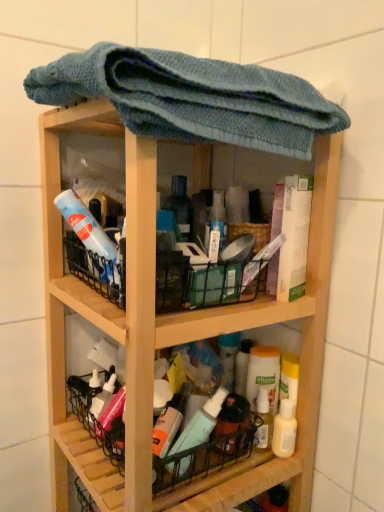
Question: Is blue knitted towel at upper center to the left of wooden shelf at center from the viewer's perspective?

Choices:
 (A) no
 (B) yes

Answer: (A)

Question: Is blue knitted towel at upper center positioned with its back to wooden shelf at center?

Choices:
 (A) no
 (B) yes

Answer: (B)

Question: From the image's perspective, is blue knitted towel at upper center below wooden shelf at center?

Choices:
 (A) no
 (B) yes

Answer: (A)

Question: Does blue knitted towel at upper center have a larger size compared to wooden shelf at center?

Choices:
 (A) yes
 (B) no

Answer: (B)

Question: Is blue knitted towel at upper center with wooden shelf at center?

Choices:
 (A) no
 (B) yes

Answer: (A)

Question: From a real-world perspective, is blue knitted towel at upper center physically below wooden shelf at center?

Choices:
 (A) no
 (B) yes

Answer: (A)

Question: Does translucent plastic mouthwash at lower right have a greater width compared to wooden shelf at center?

Choices:
 (A) yes
 (B) no

Answer: (B)

Question: Would you say translucent plastic mouthwash at lower right is outside wooden shelf at center?

Choices:
 (A) yes
 (B) no

Answer: (B)

Question: Is translucent plastic mouthwash at lower right shorter than wooden shelf at center?

Choices:
 (A) no
 (B) yes

Answer: (B)

Question: Is translucent plastic mouthwash at lower right not near wooden shelf at center?

Choices:
 (A) yes
 (B) no

Answer: (B)

Question: Is translucent plastic mouthwash at lower right closer to the viewer compared to wooden shelf at center?

Choices:
 (A) no
 (B) yes

Answer: (A)

Question: Can you confirm if translucent plastic mouthwash at lower right is positioned to the left of wooden shelf at center?

Choices:
 (A) yes
 (B) no

Answer: (B)

Question: Can we say wooden shelf at center lies outside translucent plastic mouthwash at lower right?

Choices:
 (A) no
 (B) yes

Answer: (B)